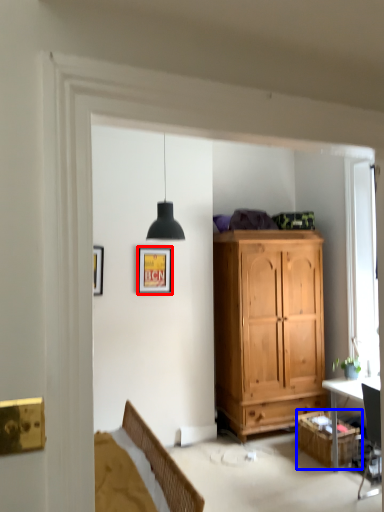
Question: Which of the following is the farthest to the observer, picture frame (highlighted by a red box) or cabinetry (highlighted by a blue box)?

Choices:
 (A) picture frame
 (B) cabinetry

Answer: (A)